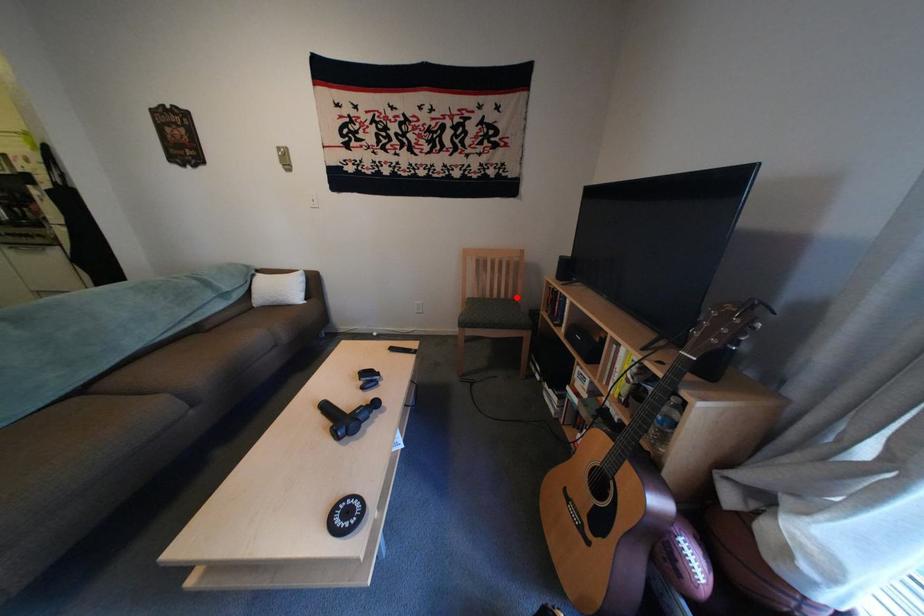
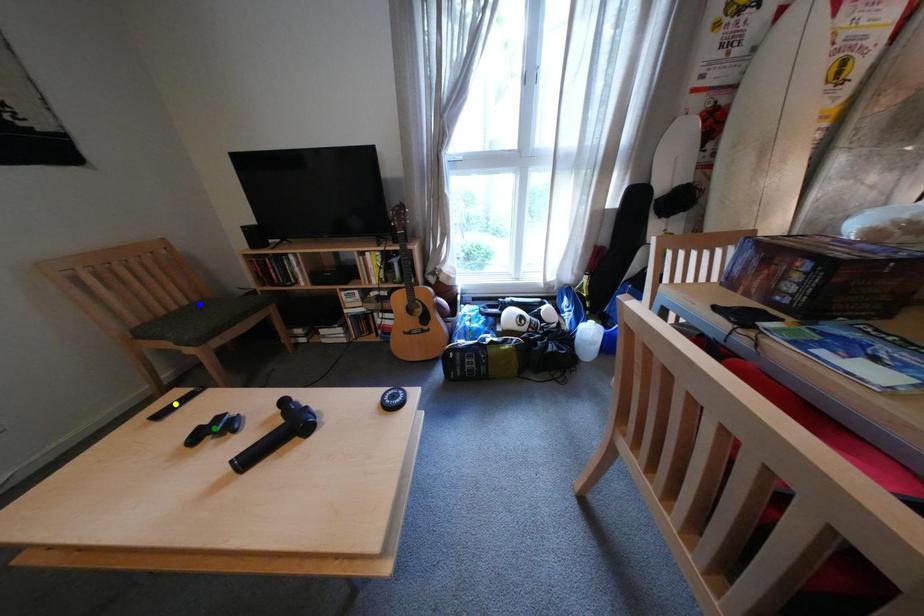
Question: I am providing you with two images of the same scene from different viewpoints. A red point is marked on the first image. You are given multiple points on the second image. Which point in image 2 is actually the same real-world point as the red point in image 1?

Choices:
 (A) green point
 (B) blue point
 (C) yellow point

Answer: (B)